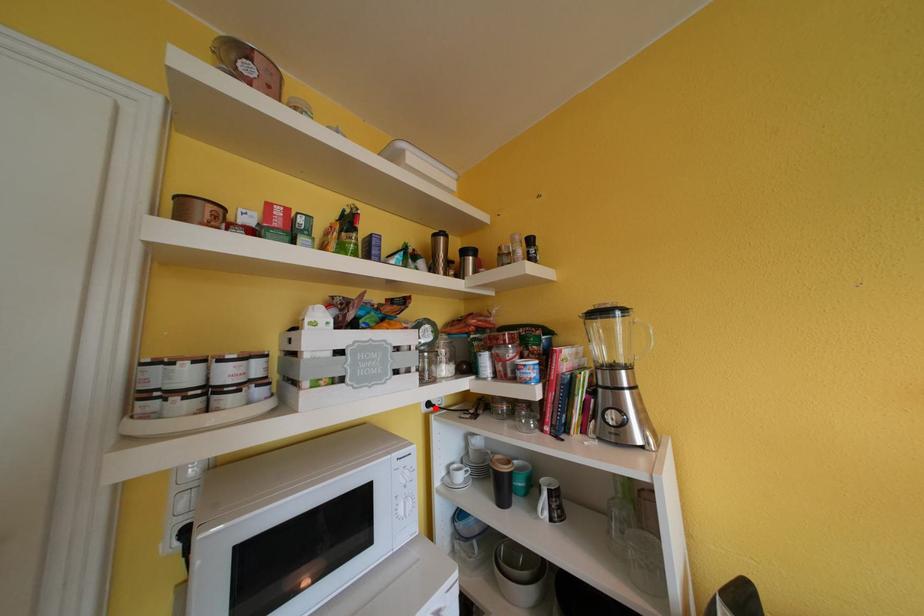
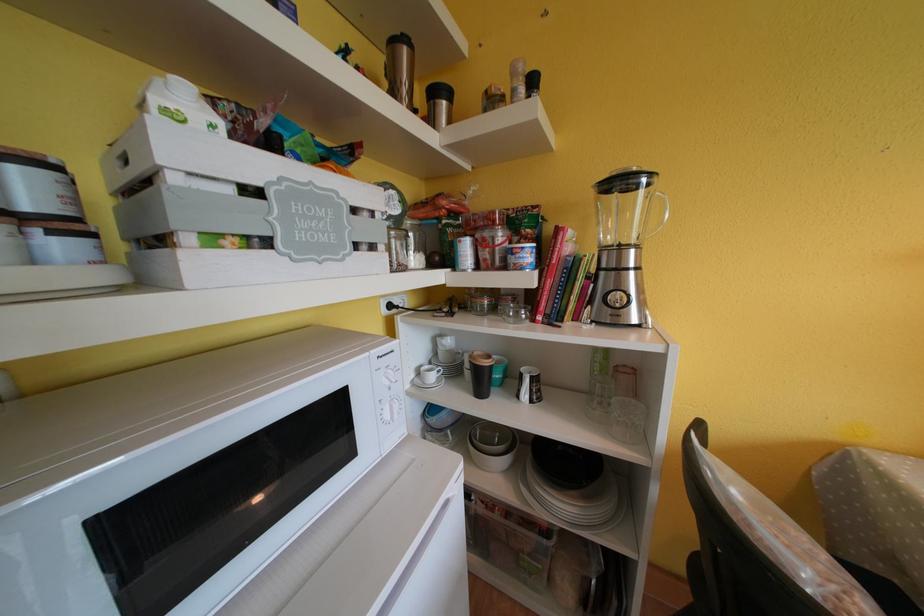
Question: I am providing you with two images of the same scene from different viewpoints. In image1, a red point is highlighted. Considering the same 3D point in image2, which of the following is correct?

Choices:
 (A) It is closer
 (B) It is farther

Answer: (A)